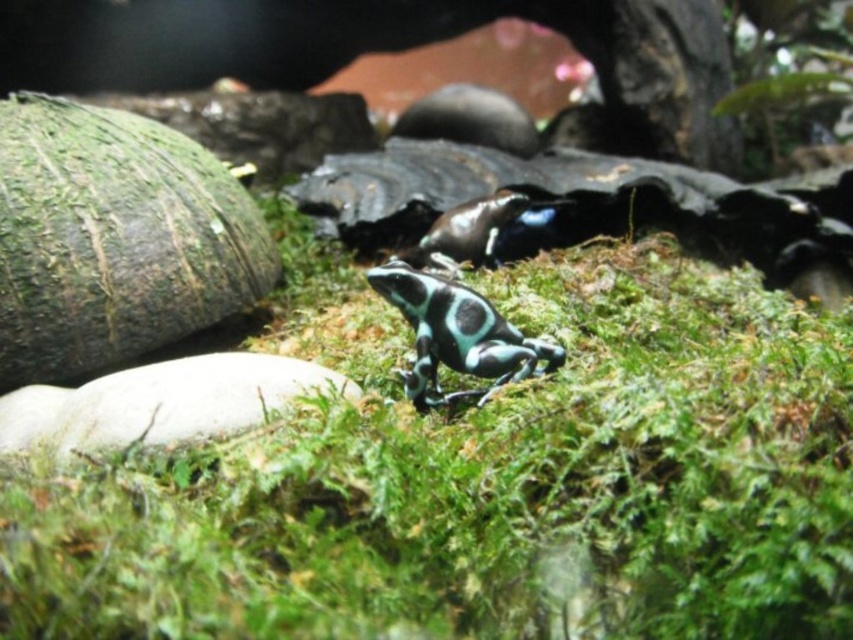
Is green mossy grass at center to the left of shiny black tortoise at center from the viewer's perspective?

Incorrect, green mossy grass at center is not on the left side of shiny black tortoise at center.

Looking at this image, can you confirm if green mossy grass at center is taller than shiny black tortoise at center?

Yes, green mossy grass at center is taller than shiny black tortoise at center.

At what (x,y) coordinates should I click in order to perform the action: click on green mossy grass at center. Please return your answer as a coordinate pair (x, y). This screenshot has height=640, width=853. Looking at the image, I should click on (480, 476).

Locate an element on the screen. The image size is (853, 640). green mossy grass at center is located at coordinates (480, 476).

Can you confirm if green mossy grass at center is smaller than smooth green tortoise at center?

No, green mossy grass at center is not smaller than smooth green tortoise at center.

Can you confirm if green mossy grass at center is thinner than smooth green tortoise at center?

Incorrect, green mossy grass at center's width is not less than smooth green tortoise at center's.

Find the location of `green mossy grass at center`. green mossy grass at center is located at coordinates (480, 476).

Identify the location of green mossy grass at center. (480, 476).

Where is `smooth green tortoise at center`? The image size is (853, 640). smooth green tortoise at center is located at coordinates (456, 333).

Looking at this image, is smooth green tortoise at center to the right of shiny black tortoise at center from the viewer's perspective?

Incorrect, smooth green tortoise at center is not on the right side of shiny black tortoise at center.

Where is `smooth green tortoise at center`? The width and height of the screenshot is (853, 640). smooth green tortoise at center is located at coordinates (456, 333).